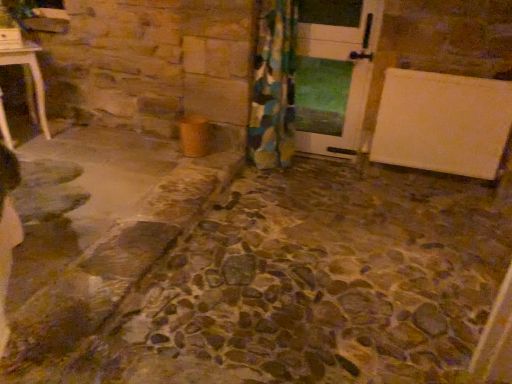
Question: Can you confirm if white glossy door at center is positioned to the right of floral fabric curtain at center?

Choices:
 (A) no
 (B) yes

Answer: (B)

Question: From a real-world perspective, is white glossy door at center positioned over floral fabric curtain at center based on gravity?

Choices:
 (A) no
 (B) yes

Answer: (B)

Question: Is white glossy door at center shorter than floral fabric curtain at center?

Choices:
 (A) yes
 (B) no

Answer: (A)

Question: From the image's perspective, is white glossy door at center below floral fabric curtain at center?

Choices:
 (A) yes
 (B) no

Answer: (B)

Question: Can you confirm if white glossy door at center is wider than floral fabric curtain at center?

Choices:
 (A) yes
 (B) no

Answer: (B)

Question: Could floral fabric curtain at center be considered to be inside white glossy door at center?

Choices:
 (A) no
 (B) yes

Answer: (A)

Question: Is white glossy door at center completely or partially inside floral fabric curtain at center?

Choices:
 (A) yes
 (B) no

Answer: (B)

Question: Considering the relative sizes of floral fabric curtain at center and white glossy door at center in the image provided, is floral fabric curtain at center thinner than white glossy door at center?

Choices:
 (A) yes
 (B) no

Answer: (B)

Question: Is floral fabric curtain at center outside of white glossy door at center?

Choices:
 (A) yes
 (B) no

Answer: (A)

Question: Is floral fabric curtain at center directly adjacent to white glossy door at center?

Choices:
 (A) yes
 (B) no

Answer: (B)

Question: Are floral fabric curtain at center and white glossy door at center located far from each other?

Choices:
 (A) yes
 (B) no

Answer: (B)

Question: From a real-world perspective, is floral fabric curtain at center over white glossy door at center?

Choices:
 (A) yes
 (B) no

Answer: (B)

Question: From a real-world perspective, is floral fabric curtain at center positioned above or below white glossy door at center?

Choices:
 (A) above
 (B) below

Answer: (B)